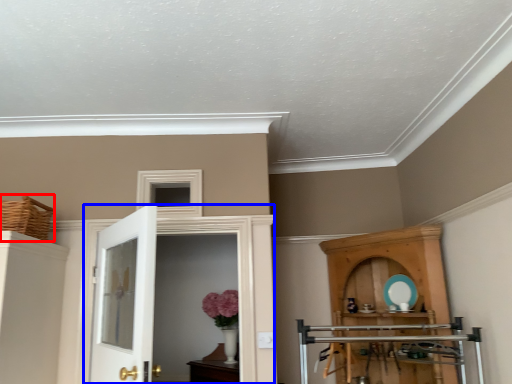
Question: Which point is further to the camera, basket (highlighted by a red box) or door (highlighted by a blue box)?

Choices:
 (A) basket
 (B) door

Answer: (B)